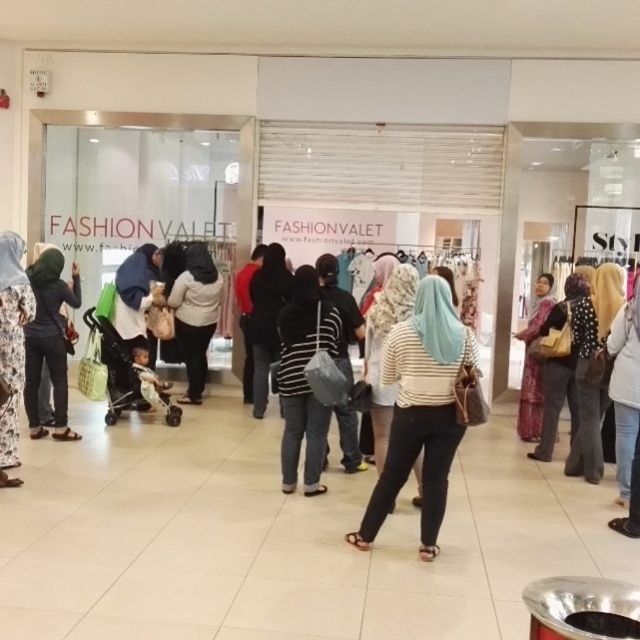
Question: Which object is closer to the camera taking this photo?

Choices:
 (A) white matte coat at center
 (B) striped fabric shirt at center

Answer: (B)

Question: Does white matte coat at center appear on the left side of matte pink dress at right?

Choices:
 (A) no
 (B) yes

Answer: (B)

Question: Which of the following is the closest to the observer?

Choices:
 (A) black fabric headscarf at center
 (B) floral printed hijab at left
 (C) striped fabric at center
 (D) white matte coat at center

Answer: (C)

Question: Among these objects, which one is nearest to the camera?

Choices:
 (A) black fabric headscarf at center
 (B) striped fabric shirt at center
 (C) matte black hijab at left
 (D) matte pink dress at right

Answer: (B)

Question: Is matte black hijab at left wider than white matte coat at center?

Choices:
 (A) yes
 (B) no

Answer: (B)

Question: Does striped fabric at center come in front of matte pink dress at right?

Choices:
 (A) no
 (B) yes

Answer: (B)